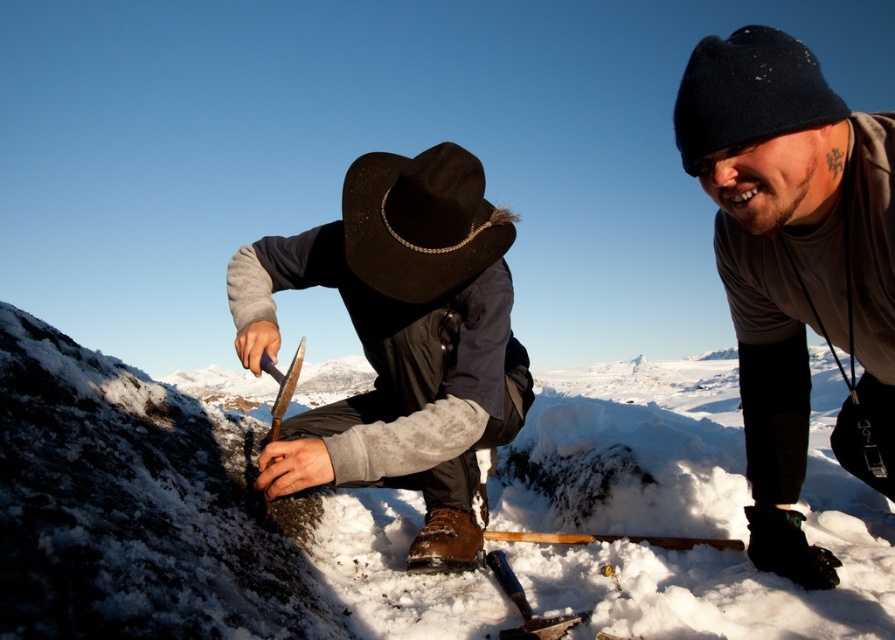
Question: Which object is closer to the camera taking this photo?

Choices:
 (A) black felt cowboy hat at upper center
 (B) black felt cowboy hat at center
 (C) rustic leather cowboy hat at center

Answer: (A)

Question: Which is nearer to the black felt cowboy hat at upper center?

Choices:
 (A) black felt cowboy hat at center
 (B) white fluffy snow at center
 (C) dark gray knit hat at upper right

Answer: (C)

Question: Considering the relative positions of rustic leather cowboy hat at center and black felt cowboy hat at center in the image provided, where is rustic leather cowboy hat at center located with respect to black felt cowboy hat at center?

Choices:
 (A) above
 (B) below

Answer: (B)

Question: Can you confirm if white fluffy snow at center is positioned to the left of black felt cowboy hat at upper center?

Choices:
 (A) yes
 (B) no

Answer: (A)

Question: Which of the following is the farthest from the observer?

Choices:
 (A) (797, 106)
 (B) (454, 148)
 (C) (781, 131)
 (D) (649, 550)

Answer: (D)

Question: Does black felt cowboy hat at center appear on the right side of black felt cowboy hat at upper center?

Choices:
 (A) yes
 (B) no

Answer: (B)